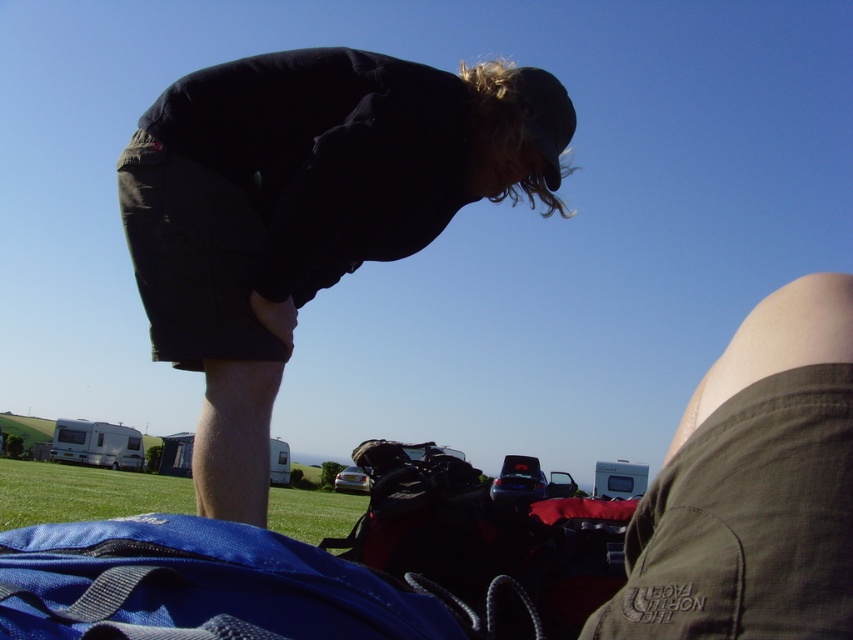
You are a photographer setting up a shot of the black fabric man at center and the green grass at lower left. To ensure both are in focus, you need to know if they are on the same plane. Are they on the same plane?

The black fabric man at center is positioned over green grass at lower left, so they are on the same plane and can be in focus simultaneously.

You are a hiker who needs to set up your tent. You see the black fabric man at center and the blue fabric sleeping bag at lower left. Which item is located to the right of the other?

The black fabric man at center is positioned on the right side of blue fabric sleeping bag at lower left.